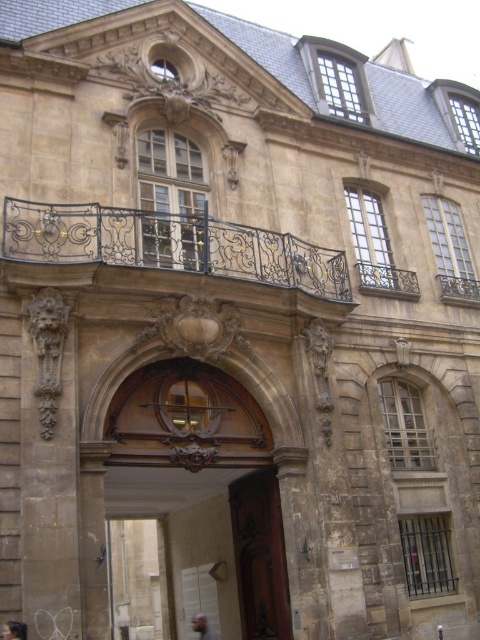
Does dark brown wrought iron balcony at upper center come behind brown polished wood door at center?

No, dark brown wrought iron balcony at upper center is in front of brown polished wood door at center.

The height and width of the screenshot is (640, 480). I want to click on dark brown wrought iron balcony at upper center, so click(x=173, y=246).

Identify the location of dark brown wrought iron balcony at upper center. The width and height of the screenshot is (480, 640). (173, 246).

Consider the image. Between dark brown hair at lower left and gray hair at center, which one appears on the right side from the viewer's perspective?

From the viewer's perspective, gray hair at center appears more on the right side.

Can you confirm if dark brown hair at lower left is positioned to the right of gray hair at center?

No, dark brown hair at lower left is not to the right of gray hair at center.

Where is `dark brown hair at lower left`? This screenshot has width=480, height=640. dark brown hair at lower left is located at coordinates (14, 630).

Where is `dark brown hair at lower left`? dark brown hair at lower left is located at coordinates 14,630.

Who is more forward, (255, 513) or (23, 625)?

Point (23, 625) is in front.

Which is more to the right, brown polished wood door at center or dark brown hair at lower left?

brown polished wood door at center is more to the right.

Which is behind, point (264, 552) or point (24, 621)?

Positioned behind is point (264, 552).

Identify the location of brown polished wood door at center. pos(260,556).